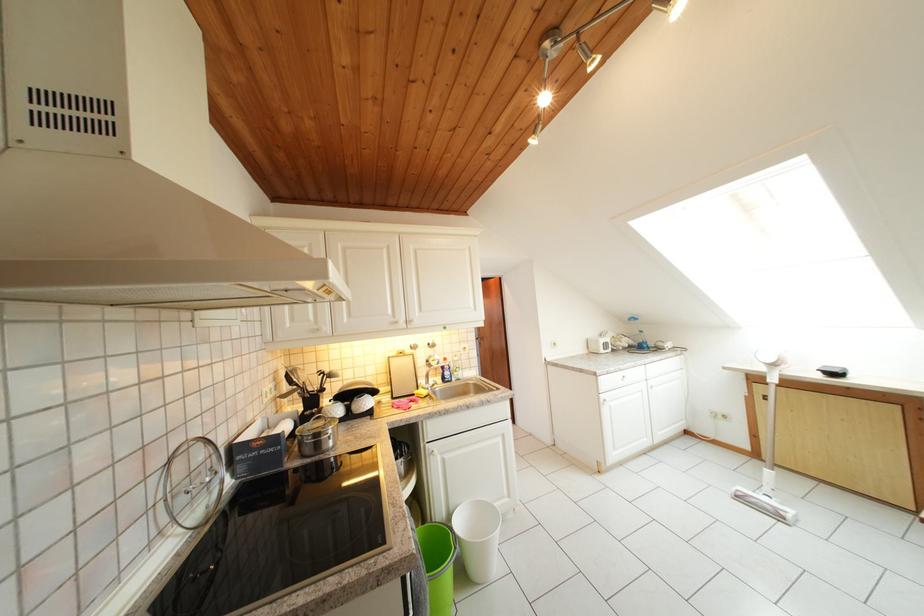
Where is `glass lid handle`? glass lid handle is located at coordinates (202, 483).